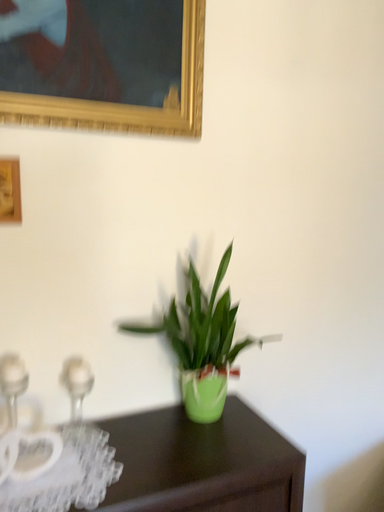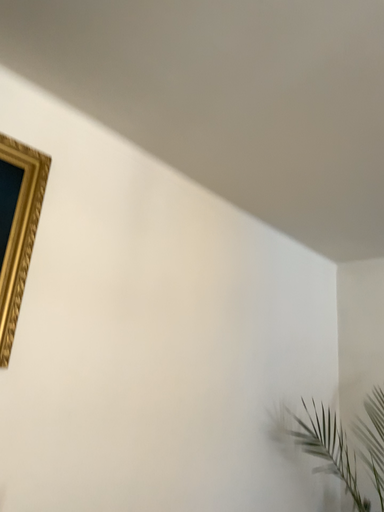
Question: How did the camera likely rotate when shooting the video?

Choices:
 (A) rotated downward
 (B) rotated upward

Answer: (B)